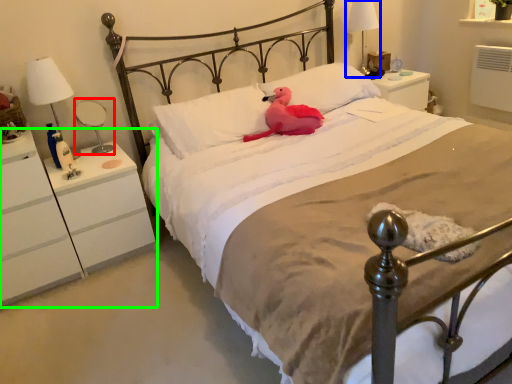
Question: Which object is positioned closest to bedside lamp (highlighted by a red box)? Select from bedside lamp (highlighted by a blue box) and nightstand (highlighted by a green box).

Choices:
 (A) bedside lamp
 (B) nightstand

Answer: (B)